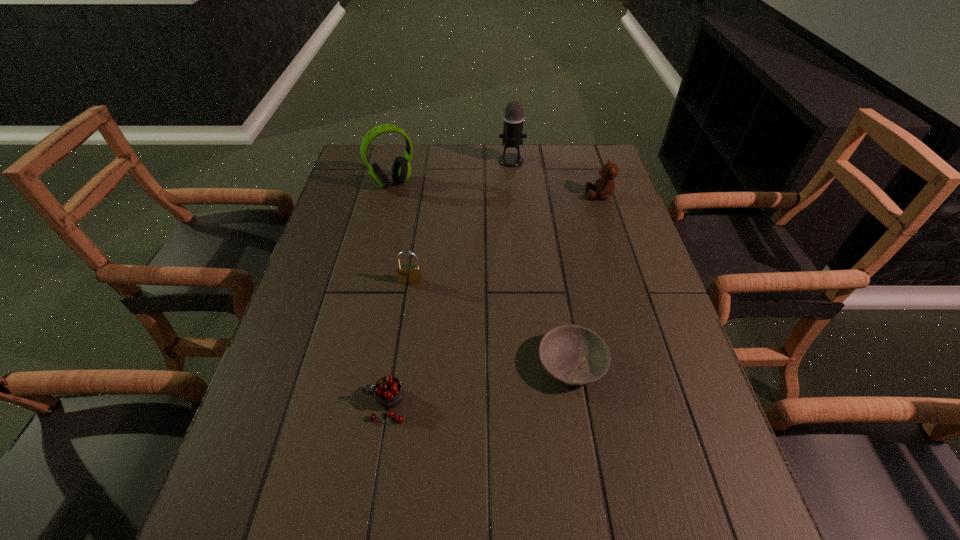
This screenshot has width=960, height=540. In order to click on object situated at the far left corner in this screenshot , I will do `click(401, 169)`.

Find the location of `vacant space at the far edge of the desktop`. vacant space at the far edge of the desktop is located at coordinates (x=465, y=163).

This screenshot has height=540, width=960. I want to click on vacant space at the left edge of the desktop, so click(389, 191).

The image size is (960, 540). In the image, there is a desktop. Identify the location of vacant space at the right edge. (651, 277).

Identify the location of vacant position at the near left corner of the desktop. (294, 536).

Locate an element on the screen. free spot between the second shortest object and the shortest object is located at coordinates (478, 384).

Where is `blank region between the headset and the shortest object`? blank region between the headset and the shortest object is located at coordinates (482, 274).

Image resolution: width=960 pixels, height=540 pixels. In order to click on free point between the second shortest object and the third nearest object in this screenshot , I will do `click(398, 343)`.

Image resolution: width=960 pixels, height=540 pixels. I want to click on free space between the rightmost object and the headset, so click(x=496, y=190).

Image resolution: width=960 pixels, height=540 pixels. I want to click on unoccupied area between the farthest object and the second shortest object, so click(448, 283).